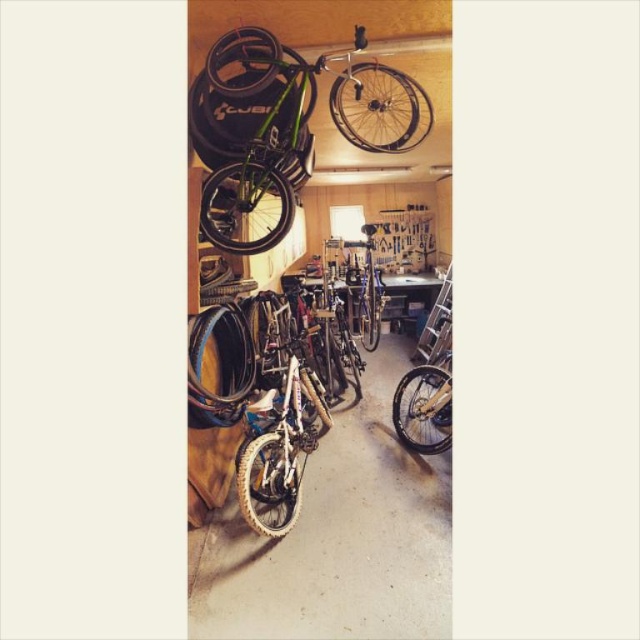
You are a mechanic working in this garage and need to move a tool box that is 3 feet wide from the black rubber tire at center to the yellow rubber tire at lower right. Can you fit the tool box between them without moving either tire?

The distance between the black rubber tire at center and the yellow rubber tire at lower right is 4.25 feet. Since the tool box is 3 feet wide, there is enough space to fit it between them without moving the tires.

You are standing in the garage and want to move from point A to point B. Point A is at coordinates point [410,410] and point B is at coordinates point [266,68]. Since you can only move forward, will you have to walk towards or away from the camera to reach point B from point A?

Since point [410,410] is further to the camera than point [266,68], you will have to walk towards the camera to reach point B from point A.

You are a customer looking to repair your bicycle. You see the shiny silver rim at upper center and the black rubber tire at center in the garage. Which object is positioned to the right side?

The shiny silver rim at upper center is positioned to the right of the black rubber tire at center.